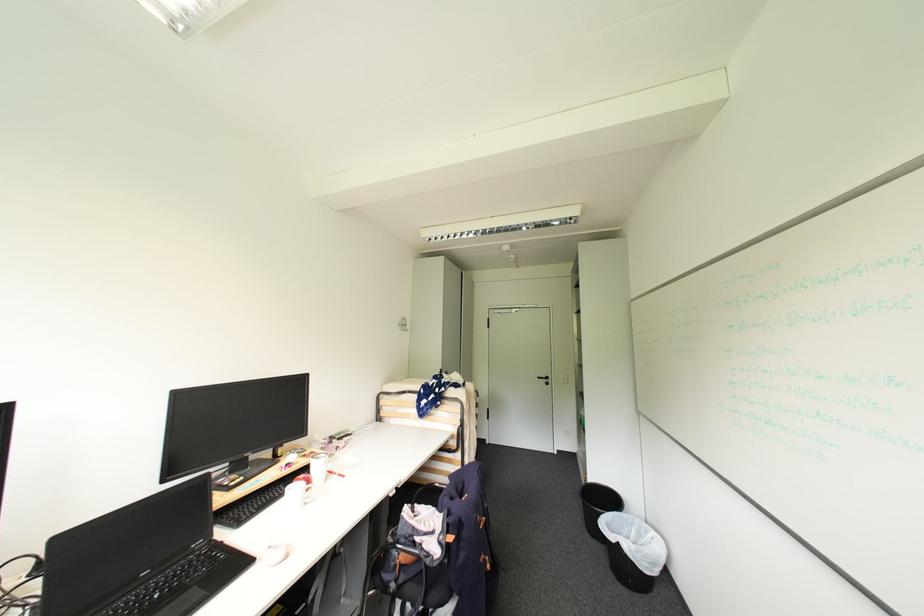
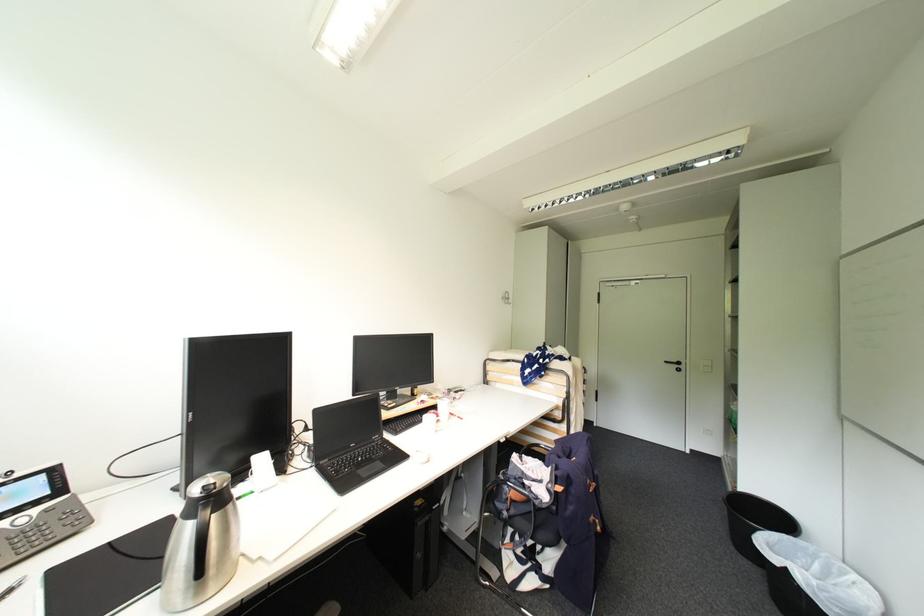
Question: The camera is either moving clockwise (left) or counter-clockwise (right) around the object. The first image is from the beginning of the video and the second image is from the end. Is the camera moving left or right when shooting the video?

Choices:
 (A) Left
 (B) Right

Answer: (B)